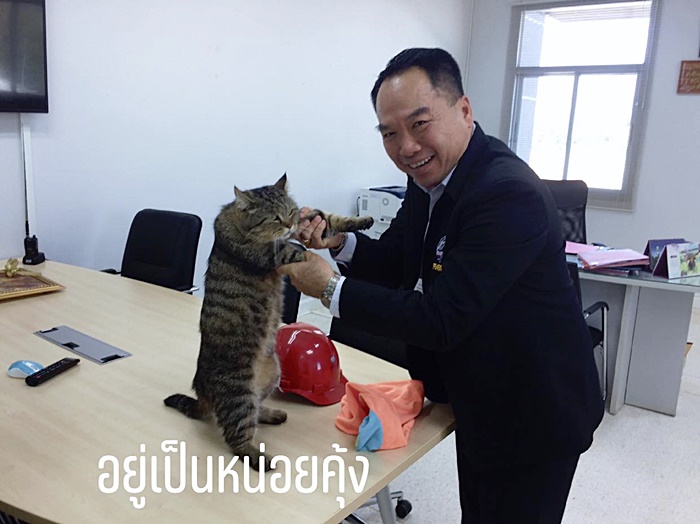
The image size is (700, 524). What are the coordinates of `window` in the screenshot? It's located at (561, 91).